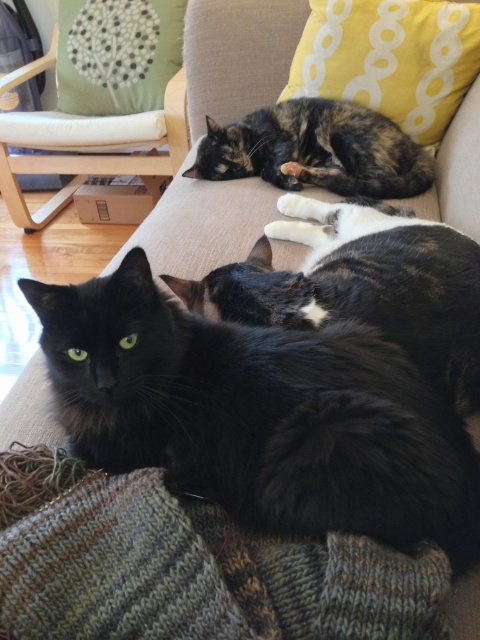
Question: Which object is the closest to the black fluffy cat at center?

Choices:
 (A) tortoiseshell fur cat at upper center
 (B) black fluffy cat at lower left

Answer: (B)

Question: Estimate the real-world distances between objects in this image. Which object is farther from the black fluffy cat at center?

Choices:
 (A) yellow dotted pillow at upper right
 (B) green fabric pillow at upper left
 (C) knitted woolen blanket at lower left
 (D) tortoiseshell fur cat at upper center

Answer: (B)

Question: Does black fluffy cat at lower left appear on the right side of black fluffy cat at center?

Choices:
 (A) yes
 (B) no

Answer: (B)

Question: Which point appears closest to the camera in this image?

Choices:
 (A) (217, 556)
 (B) (420, 67)

Answer: (A)

Question: From the image, what is the correct spatial relationship of yellow dotted pillow at upper right in relation to tortoiseshell fur cat at upper center?

Choices:
 (A) left
 (B) right

Answer: (B)

Question: Can you confirm if black fluffy cat at center is positioned to the left of yellow dotted pillow at upper right?

Choices:
 (A) no
 (B) yes

Answer: (B)